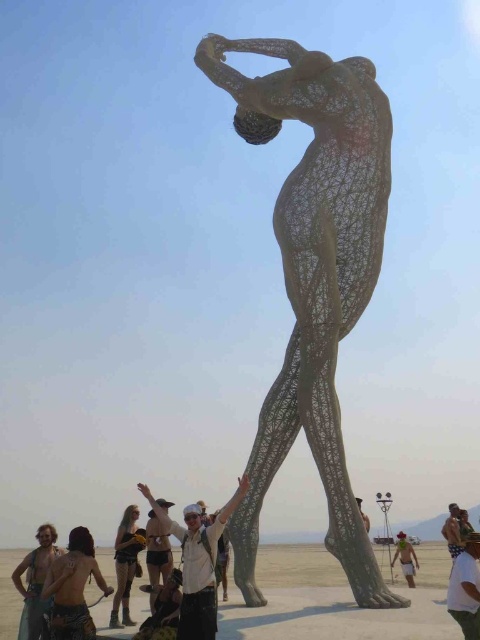
Does shiny silver bikini at lower left have a greater width compared to white matte shirt at center?

Indeed, shiny silver bikini at lower left has a greater width compared to white matte shirt at center.

Who is positioned more to the right, shiny silver bikini at lower left or white matte shirt at center?

white matte shirt at center

What do you see at coordinates (36, 584) in the screenshot? This screenshot has height=640, width=480. I see `shiny silver bikini at lower left` at bounding box center [36, 584].

Find the location of `shiny silver bikini at lower left`. shiny silver bikini at lower left is located at coordinates (36, 584).

Is point (194, 570) behind point (54, 556)?

No, (194, 570) is closer to viewer.

Between white cotton shirt at lower center and shiny silver bikini at lower left, which one appears on the left side from the viewer's perspective?

Positioned to the left is shiny silver bikini at lower left.

Is point (212, 556) farther from camera compared to point (47, 632)?

No.

Identify the location of white cotton shirt at lower center. This screenshot has width=480, height=640. (197, 561).

Does shiny silver bikini at lower left appear on the right side of matte gray statue at center?

In fact, shiny silver bikini at lower left is to the left of matte gray statue at center.

Between shiny silver bikini at lower left and matte gray statue at center, which one is positioned lower?

matte gray statue at center

What do you see at coordinates (36, 584) in the screenshot?
I see `shiny silver bikini at lower left` at bounding box center [36, 584].

Locate an element on the screen. The width and height of the screenshot is (480, 640). shiny silver bikini at lower left is located at coordinates (36, 584).